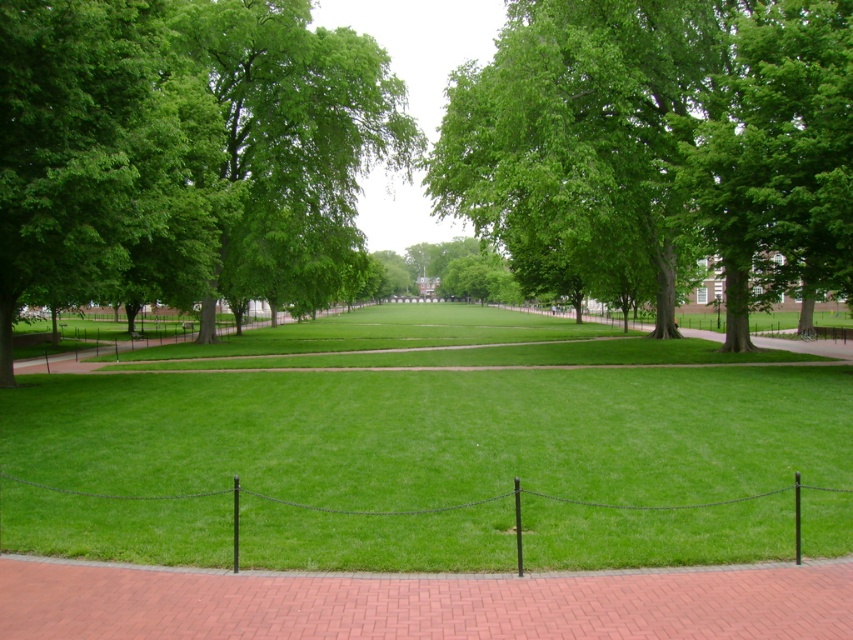
Between green leafy tree at center and brick path at center, which one has less height?

brick path at center is shorter.

Consider the image. Measure the distance from green leafy tree at center to brick path at center.

101.52 feet

Between point (634, 16) and point (381, 582), which one is positioned behind?

The point (634, 16) is more distant.

This screenshot has width=853, height=640. I want to click on green leafy tree at center, so click(x=659, y=145).

What do you see at coordinates (463, 445) in the screenshot?
I see `green grass at center` at bounding box center [463, 445].

Is green grass at center to the right of green leafy tree at center from the viewer's perspective?

Incorrect, green grass at center is not on the right side of green leafy tree at center.

Identify the location of green grass at center. This screenshot has width=853, height=640. (463, 445).

Does point (125, 380) come in front of point (61, 164)?

No, (125, 380) is behind (61, 164).

Is green grass at center positioned in front of green leafy tree at upper left?

Yes, it is in front of green leafy tree at upper left.

Find the location of a particular element. green grass at center is located at coordinates (463, 445).

Locate an element on the screen. The image size is (853, 640). green grass at center is located at coordinates (463, 445).